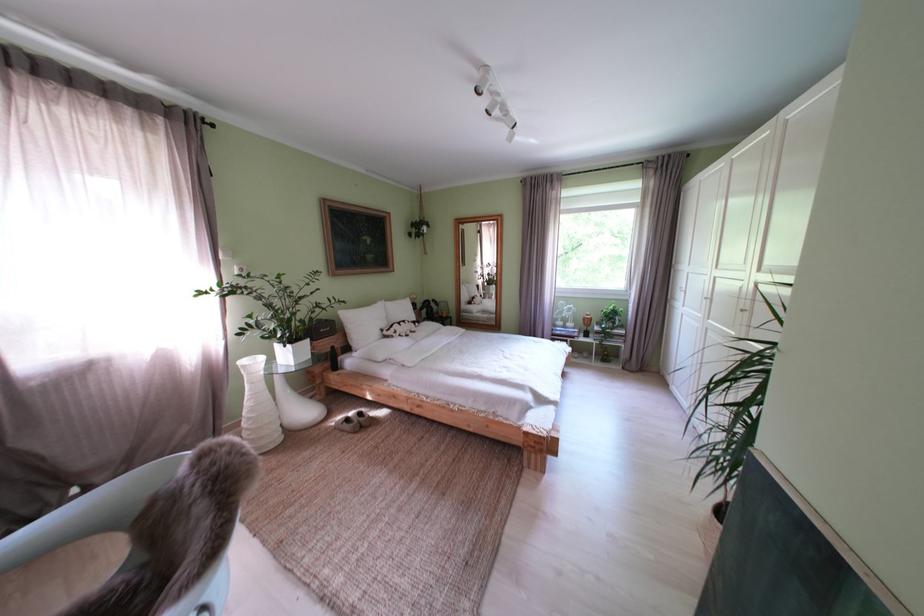
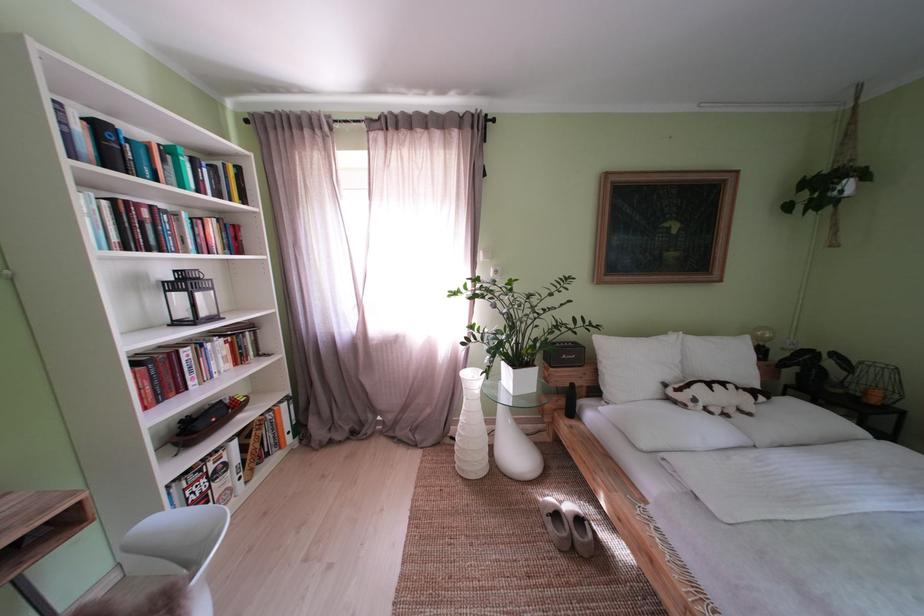
Locate, in the second image, the point that corresponds to pixel 407 338 in the first image.

(706, 406)